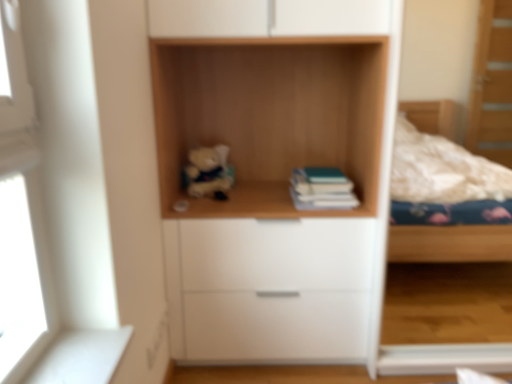
Question: In the image, is soft plush bear at center on the left side or the right side of white matte drawer at center?

Choices:
 (A) right
 (B) left

Answer: (B)

Question: Considering the positions of soft plush bear at center and white matte drawer at center in the image, is soft plush bear at center wider or thinner than white matte drawer at center?

Choices:
 (A) wide
 (B) thin

Answer: (B)

Question: Which is nearer to the white matte drawer at center?

Choices:
 (A) soft plush bear at center
 (B) teal matte book at center
 (C) wooden shelf at center

Answer: (B)

Question: Considering the real-world distances, which object is closest to the teal matte book at center?

Choices:
 (A) white matte drawer at center
 (B) soft plush bear at center
 (C) wooden shelf at center

Answer: (C)